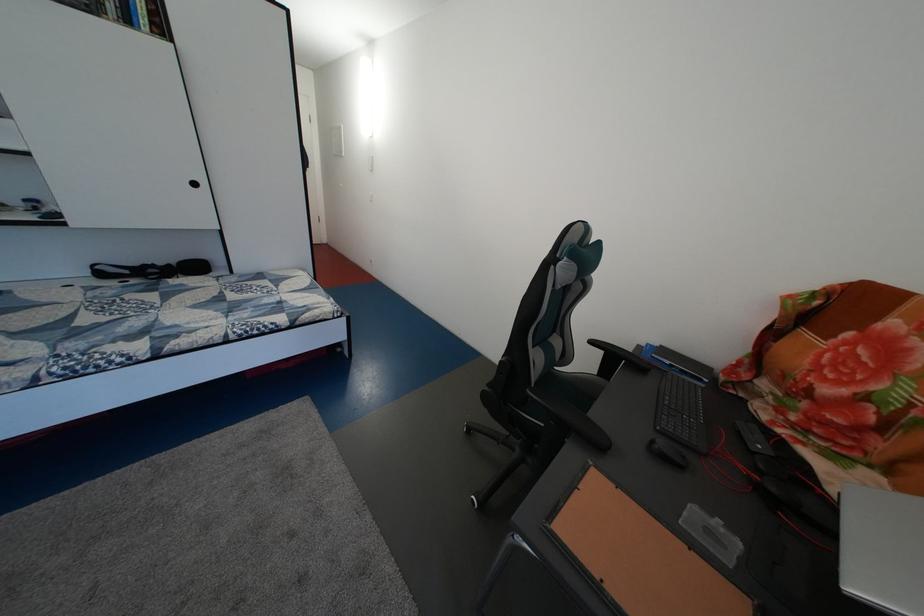
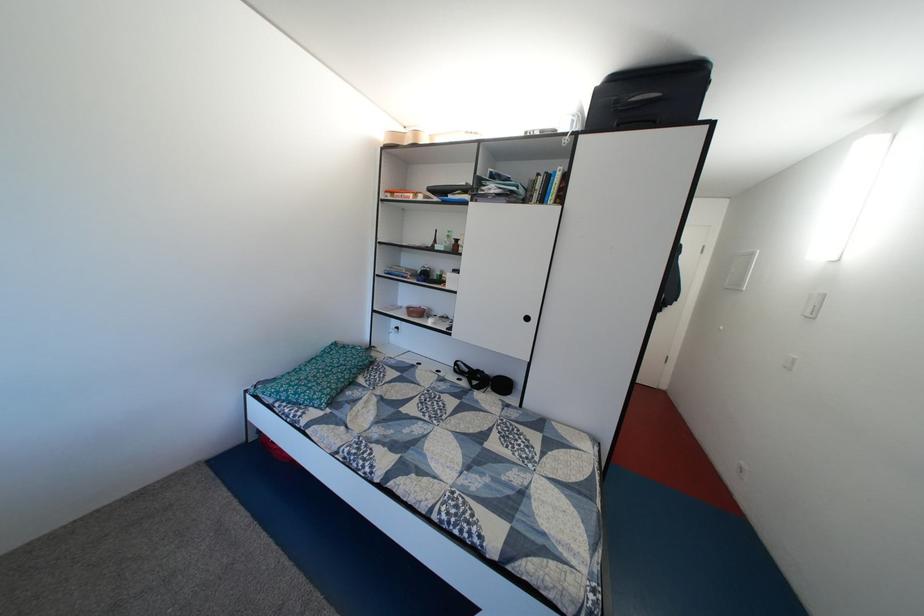
Question: Based on the continuous images, in which direction is the camera rotating? Reply with the corresponding letter.

Choices:
 (A) Left
 (B) Right
 (C) Up
 (D) Down

Answer: (A)